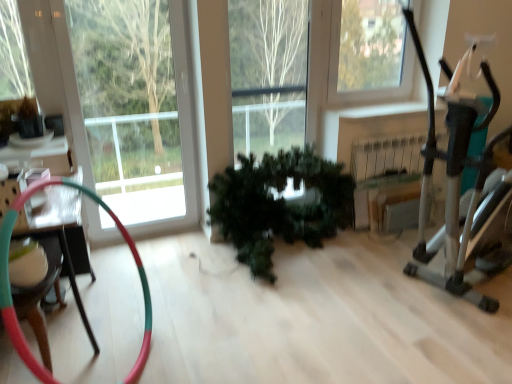
Question: In the image, is green matte plant at center positioned in front of or behind clear glass window at upper right?

Choices:
 (A) front
 (B) behind

Answer: (A)

Question: Do you think green matte plant at center is within clear glass window at upper right, or outside of it?

Choices:
 (A) inside
 (B) outside

Answer: (B)

Question: Which object is positioned closest to the green matte plant at center?

Choices:
 (A) clear glass window at upper right
 (B) metallic silver exercise machine at right
 (C) multicolored rubber hose at left

Answer: (B)

Question: Which object is the farthest from the green matte plant at center?

Choices:
 (A) metallic silver exercise machine at right
 (B) multicolored rubber hose at left
 (C) clear glass window at upper right

Answer: (B)